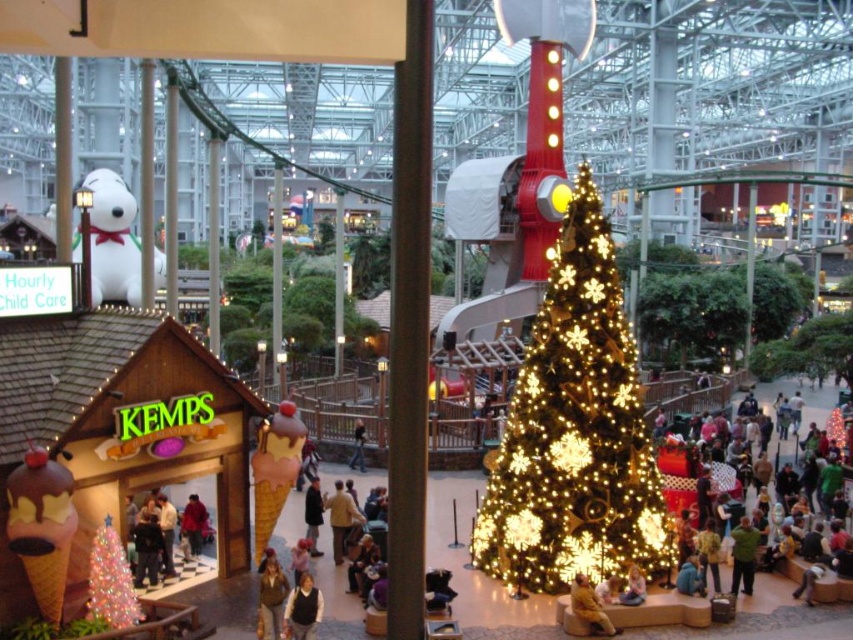
You are a visitor at the mall and want to take a photo of both the white plush snowman at left and the shiny silver christmas tree at lower left. Which object should you aim your camera at first to ensure both are in the frame?

You should aim your camera at the shiny silver christmas tree at lower left first because the white plush snowman at left is located above it, so starting with the lower object ensures both are visible in the frame.